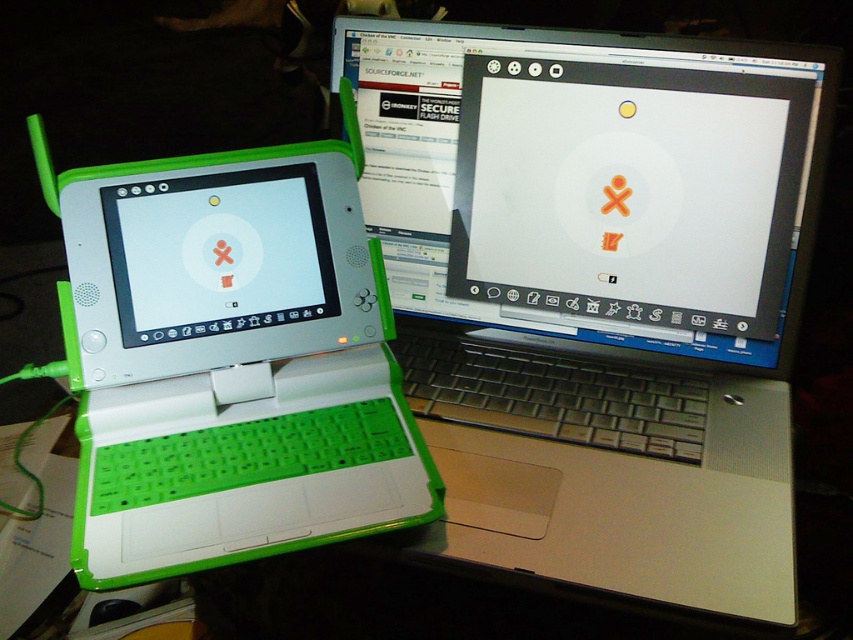
Question: Which is farther from the white matte screen at left?

Choices:
 (A) green plastic laptop at center
 (B) green matte laptop at left

Answer: (A)

Question: Is green matte laptop at left to the left of white matte screen at left from the viewer's perspective?

Choices:
 (A) yes
 (B) no

Answer: (B)

Question: Which is farther from the green plastic laptop at center?

Choices:
 (A) green matte laptop at left
 (B) white matte screen at left

Answer: (B)

Question: Can you confirm if green matte laptop at left is positioned above white matte screen at left?

Choices:
 (A) no
 (B) yes

Answer: (A)

Question: Which point is closer to the camera taking this photo?

Choices:
 (A) (102, 196)
 (B) (317, 276)

Answer: (A)

Question: Is green plastic laptop at center above green matte laptop at left?

Choices:
 (A) yes
 (B) no

Answer: (A)